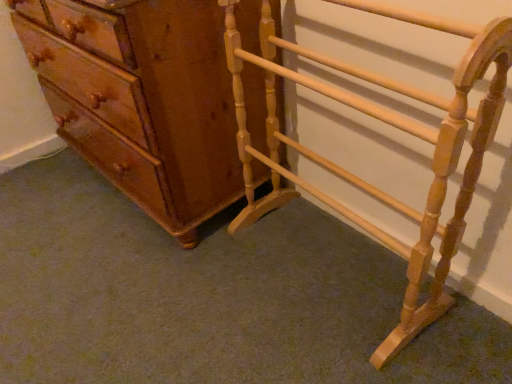
Question: Is light wood towel rack at right aimed at matte brown chest of drawers at left?

Choices:
 (A) yes
 (B) no

Answer: (B)

Question: From a real-world perspective, is light wood towel rack at right positioned under matte brown chest of drawers at left based on gravity?

Choices:
 (A) no
 (B) yes

Answer: (B)

Question: Can we say light wood towel rack at right lies outside matte brown chest of drawers at left?

Choices:
 (A) no
 (B) yes

Answer: (B)

Question: Does light wood towel rack at right appear on the left side of matte brown chest of drawers at left?

Choices:
 (A) yes
 (B) no

Answer: (B)

Question: Is matte brown chest of drawers at left located within light wood towel rack at right?

Choices:
 (A) no
 (B) yes

Answer: (A)

Question: Does light wood towel rack at right have a smaller size compared to matte brown chest of drawers at left?

Choices:
 (A) yes
 (B) no

Answer: (A)

Question: Can you confirm if matte brown chest of drawers at left is shorter than light wood towel rack at right?

Choices:
 (A) no
 (B) yes

Answer: (B)

Question: Is matte brown chest of drawers at left behind light wood towel rack at right?

Choices:
 (A) no
 (B) yes

Answer: (B)

Question: Considering the relative sizes of matte brown chest of drawers at left and light wood towel rack at right in the image provided, is matte brown chest of drawers at left smaller than light wood towel rack at right?

Choices:
 (A) yes
 (B) no

Answer: (B)

Question: Does matte brown chest of drawers at left have a lesser width compared to light wood towel rack at right?

Choices:
 (A) yes
 (B) no

Answer: (B)

Question: Can you confirm if matte brown chest of drawers at left is taller than light wood towel rack at right?

Choices:
 (A) yes
 (B) no

Answer: (B)

Question: Is matte brown chest of drawers at left not within light wood towel rack at right?

Choices:
 (A) no
 (B) yes

Answer: (B)

Question: From their relative heights in the image, would you say light wood towel rack at right is taller or shorter than matte brown chest of drawers at left?

Choices:
 (A) tall
 (B) short

Answer: (A)